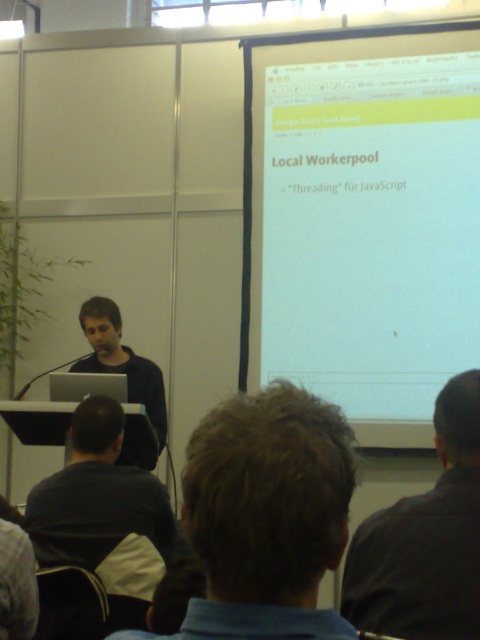
Is white matte projector screen at upper center to the right of matte black laptop at center from the viewer's perspective?

Indeed, white matte projector screen at upper center is positioned on the right side of matte black laptop at center.

Does white matte projector screen at upper center have a greater width compared to matte black laptop at center?

Yes.

This screenshot has width=480, height=640. In order to click on white matte projector screen at upper center in this screenshot , I will do `click(364, 221)`.

Can you confirm if brown hair at center is wider than matte black laptop at center?

No, brown hair at center is not wider than matte black laptop at center.

Is brown hair at center to the right of matte black laptop at center from the viewer's perspective?

Indeed, brown hair at center is positioned on the right side of matte black laptop at center.

You are a GUI agent. You are given a task and a screenshot of the screen. Output one action in this format:
    pyautogui.click(x=<x>, y=<y>)
    Task: Click on the brown hair at center
    This screenshot has height=640, width=480.
    Given the screenshot: What is the action you would take?
    pyautogui.click(x=265, y=516)

Looking at this image, which is more to the left, dark gray shirt at upper right or dark gray shirt at lower left?

From the viewer's perspective, dark gray shirt at lower left appears more on the left side.

Does dark gray shirt at upper right have a larger size compared to dark gray shirt at lower left?

No.

This screenshot has width=480, height=640. In order to click on dark gray shirt at upper right in this screenshot , I will do `click(425, 540)`.